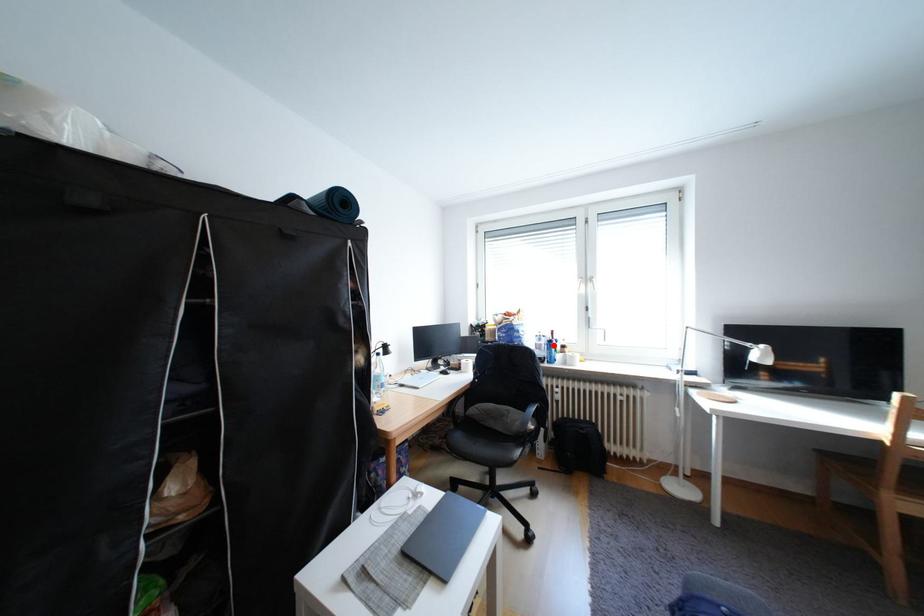
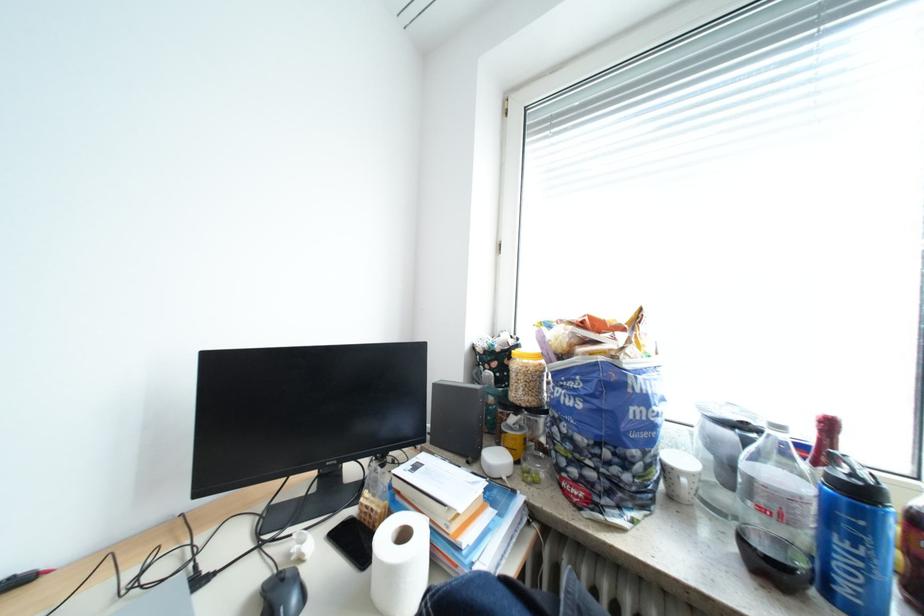
In the second image, find the point that corresponds to the highlighted location in the first image.

(807, 499)